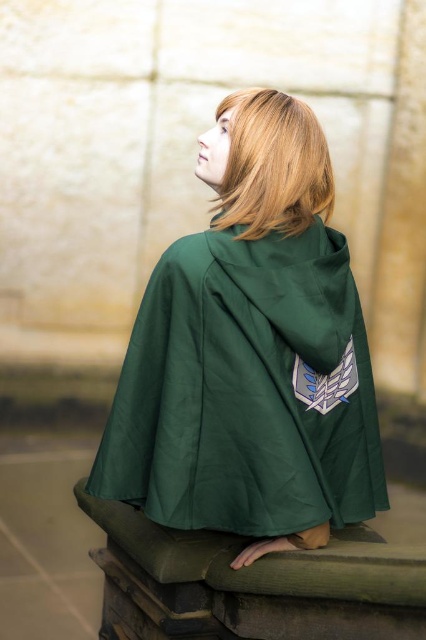
You are an artist sketching the scene and need to decide which object to draw first based on their size. Since the green fabric cape at center and the blonde silky hair at upper center are both important, which one should you start with if you want to tackle the larger object first?

The green fabric cape at center is larger than the blonde silky hair at upper center, so you should start drawing the green fabric cape at center first.

You are a photographer trying to capture the best shot of the scene. You notice two points in the image at coordinates point (253, 285) and point (247, 170). Which point should you focus on to ensure it appears sharper in the photo?

Point (253, 285) is closer to the camera than point (247, 170), so focusing on point (253, 285) will ensure it appears sharper in the photo.

You are a tailor observing a person wearing a green fabric cape at center and having blonde silky hair at upper center. Which object is located more to the left?

The green fabric cape at center is positioned on the left side of blonde silky hair at upper center.